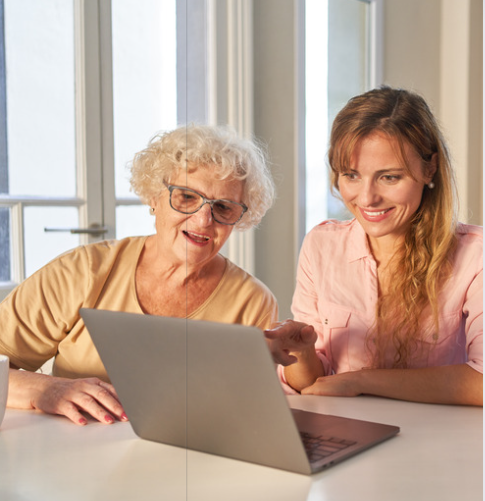
Identify the location of window. The width and height of the screenshot is (485, 501). (53, 114), (156, 79), (316, 106).